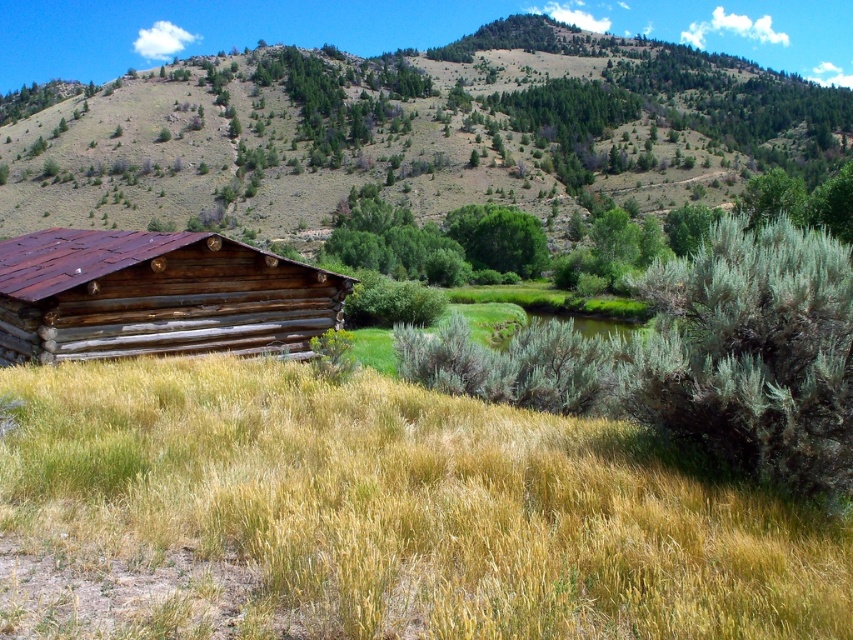
Question: In this image, where is green grassy hillside at upper center located relative to brown wooden log cabin at left?

Choices:
 (A) below
 (B) above

Answer: (B)

Question: Which point is farther to the camera?

Choices:
 (A) brown wooden log cabin at left
 (B) green grassy hillside at upper center

Answer: (B)

Question: Which point is farther to the camera?

Choices:
 (A) green grassy hillside at upper center
 (B) dry grass at lower left
 (C) brown wooden log cabin at left

Answer: (A)

Question: Can you confirm if dry grass at lower left is wider than green grassy hillside at upper center?

Choices:
 (A) yes
 (B) no

Answer: (B)

Question: Is dry grass at lower left to the left of brown wooden log cabin at left from the viewer's perspective?

Choices:
 (A) no
 (B) yes

Answer: (A)

Question: Which of the following is the closest to the observer?

Choices:
 (A) (370, 134)
 (B) (605, 525)
 (C) (80, 358)

Answer: (B)